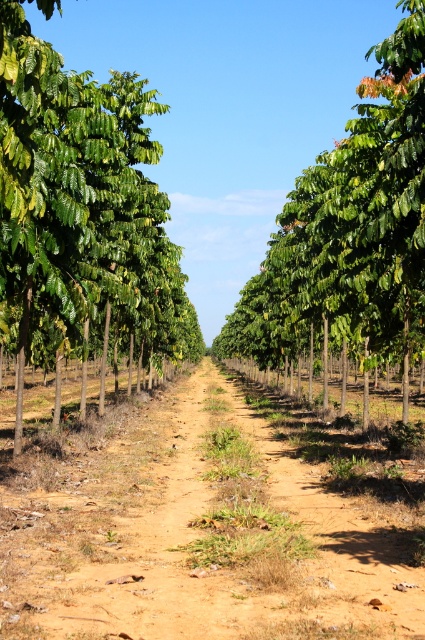
Question: Among these points, which one is nearest to the camera?

Choices:
 (A) (401, 269)
 (B) (164, 605)
 (C) (102, 157)

Answer: (B)

Question: Which point is closer to the camera taking this photo?

Choices:
 (A) (98, 532)
 (B) (291, 288)

Answer: (A)

Question: Observing the image, what is the correct spatial positioning of brown sandy soil at center in reference to green leafy tree at center?

Choices:
 (A) above
 (B) below

Answer: (B)

Question: Which of the following is the farthest from the observer?

Choices:
 (A) (289, 561)
 (B) (136, 132)

Answer: (B)

Question: Does brown sandy soil at center appear on the left side of green leafy tree at center?

Choices:
 (A) yes
 (B) no

Answer: (A)

Question: Can you confirm if brown sandy soil at center is bigger than green leafy tree at left?

Choices:
 (A) yes
 (B) no

Answer: (B)